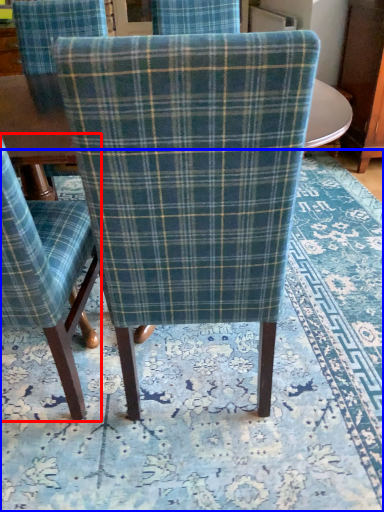
Question: Which of the following is the farthest to the observer, chair (highlighted by a red box) or mat (highlighted by a blue box)?

Choices:
 (A) chair
 (B) mat

Answer: (B)